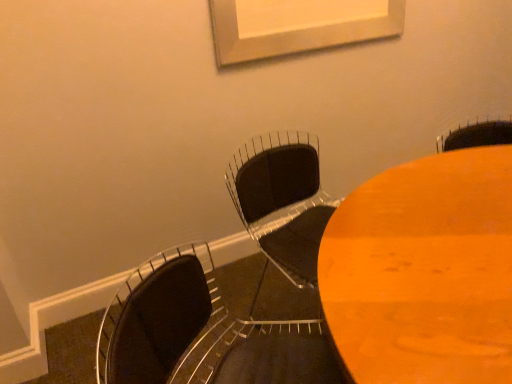
Question: Is wooden table at center inside or outside of black matte chair at center, positioned as the 2th chair in front-to-back order?

Choices:
 (A) outside
 (B) inside

Answer: (A)

Question: Is point (442, 342) closer or farther from the camera than point (239, 201)?

Choices:
 (A) closer
 (B) farther

Answer: (A)

Question: Based on their relative distances, which object is farther from the matte black chair at lower left, the 1th chair in the front-to-back sequence?

Choices:
 (A) black matte chair at center, positioned as the first chair in back-to-front order
 (B) wooden table at center

Answer: (A)

Question: Considering the real-world distances, which object is farthest from the black matte chair at center, positioned as the first chair in back-to-front order?

Choices:
 (A) matte black chair at lower left, the 2th chair viewed from the back
 (B) wooden table at center

Answer: (A)